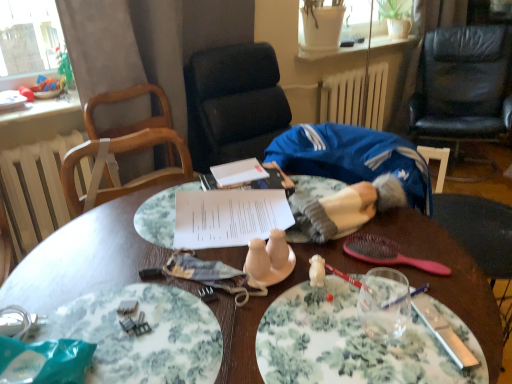
At what (x,y) coordinates should I click in order to perform the action: click on vacant position to the left of white ceramic salt and pepper shakers at center. Please return your answer as a coordinate pair (x, y). Looking at the image, I should click on (178, 284).